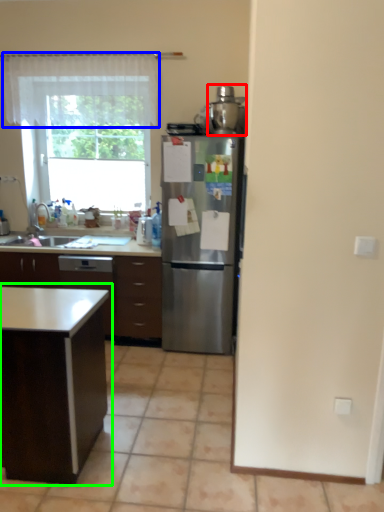
Question: Which object is positioned farthest from appliance (highlighted by a red box)? Select from curtain (highlighted by a blue box) and table (highlighted by a green box).

Choices:
 (A) curtain
 (B) table

Answer: (B)